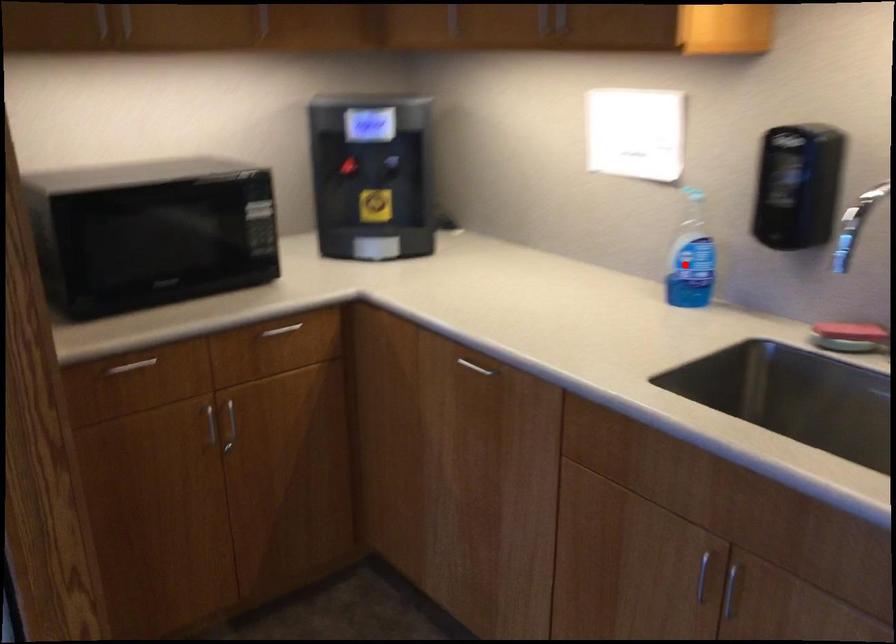
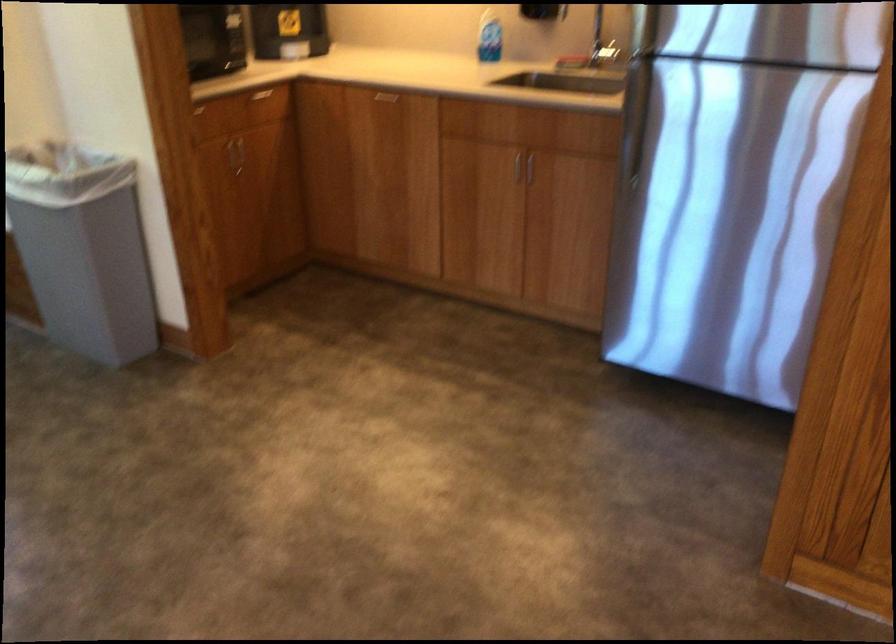
Where in the second image is the point corresponding to the highlighted location from the first image?

(488, 37)